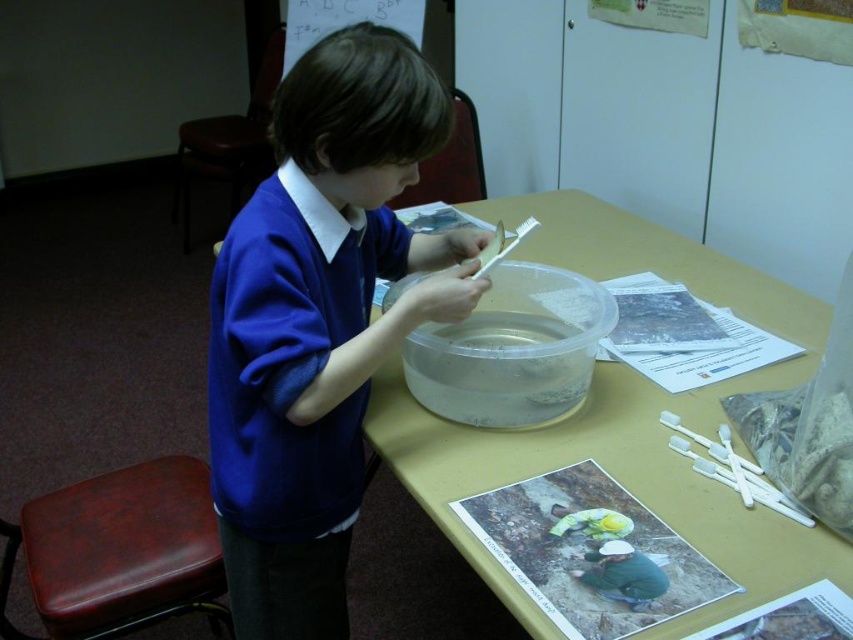
You are a person with a 60 cm wide backpack. You want to walk between the translucent plastic table at center and the brown leather stool at lower left. Can you fit through the space between them?

The distance between the translucent plastic table at center and the brown leather stool at lower left is 66.73 centimeters. Since your backpack is 60 cm wide, you can fit through the space as 66.73 cm is wider than 60 cm.